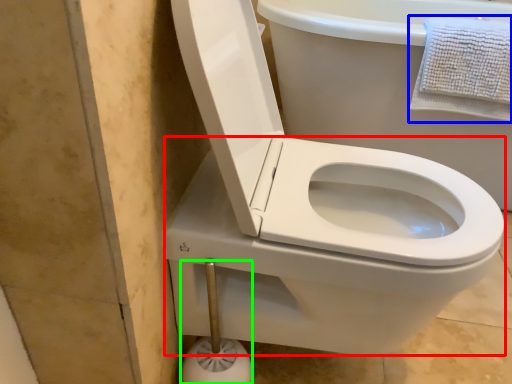
Question: Considering the real-world distances, which object is farthest from bidet (highlighted by a red box)? bath towel (highlighted by a blue box) or towel bar (highlighted by a green box)?

Choices:
 (A) bath towel
 (B) towel bar

Answer: (A)